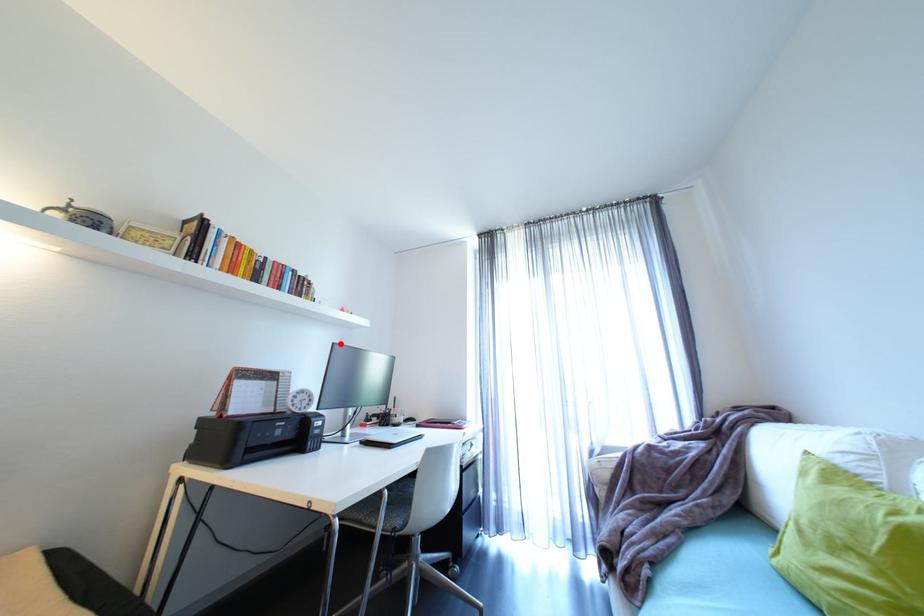
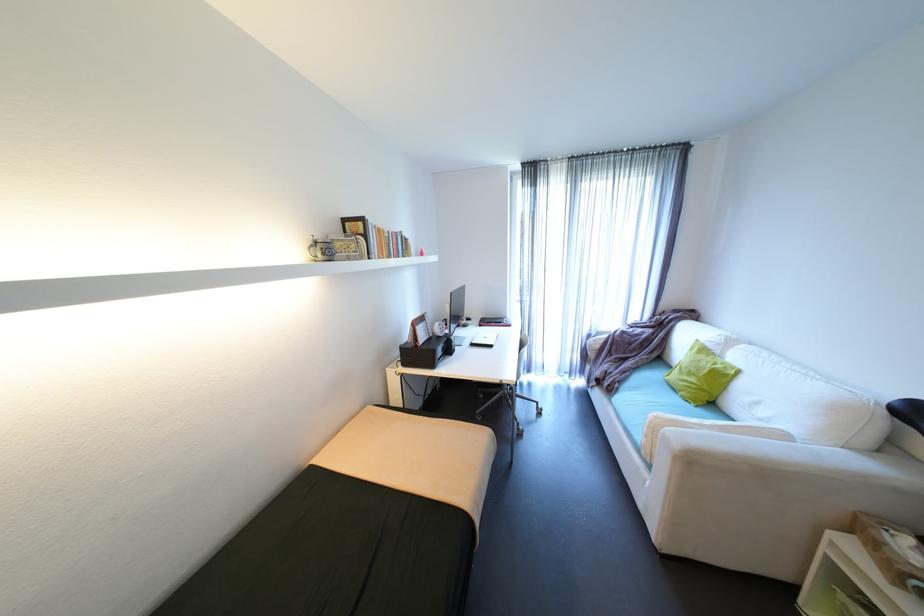
Question: I am providing you with two images of the same scene from different viewpoints. A red point is shown in image1. For the corresponding object point in image2, is it positioned nearer or farther from the camera?

Choices:
 (A) Nearer
 (B) Farther

Answer: (A)